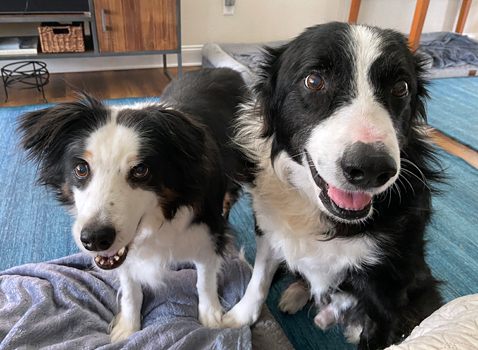
I want to click on blue rug, so click(461, 206), click(457, 117).